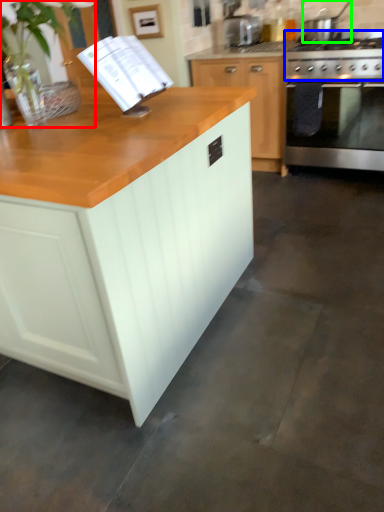
Question: Considering the real-world distances, which object is closest to plant (highlighted by a red box)? gas stove (highlighted by a blue box) or kitchen appliance (highlighted by a green box).

Choices:
 (A) gas stove
 (B) kitchen appliance

Answer: (A)